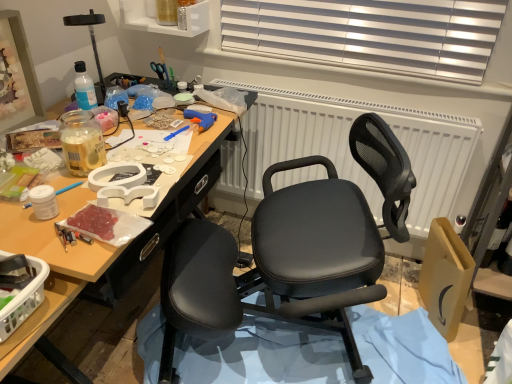
Question: Considering their positions, is black leather chair at center located in front of or behind translucent plastic basket at lower left?

Choices:
 (A) front
 (B) behind

Answer: (B)

Question: From a real-world perspective, relative to translucent plastic basket at lower left, is black leather chair at center vertically above or below?

Choices:
 (A) above
 (B) below

Answer: (B)

Question: Estimate the real-world distances between objects in this image. Which object is farther from the clear plastic bottle at upper center?

Choices:
 (A) white textured radiator at center
 (B) black leather chair at center
 (C) translucent plastic basket at lower left

Answer: (C)

Question: Which object is the farthest from the black leather chair at center?

Choices:
 (A) white textured radiator at center
 (B) translucent plastic basket at lower left
 (C) clear plastic bottle at upper center

Answer: (C)